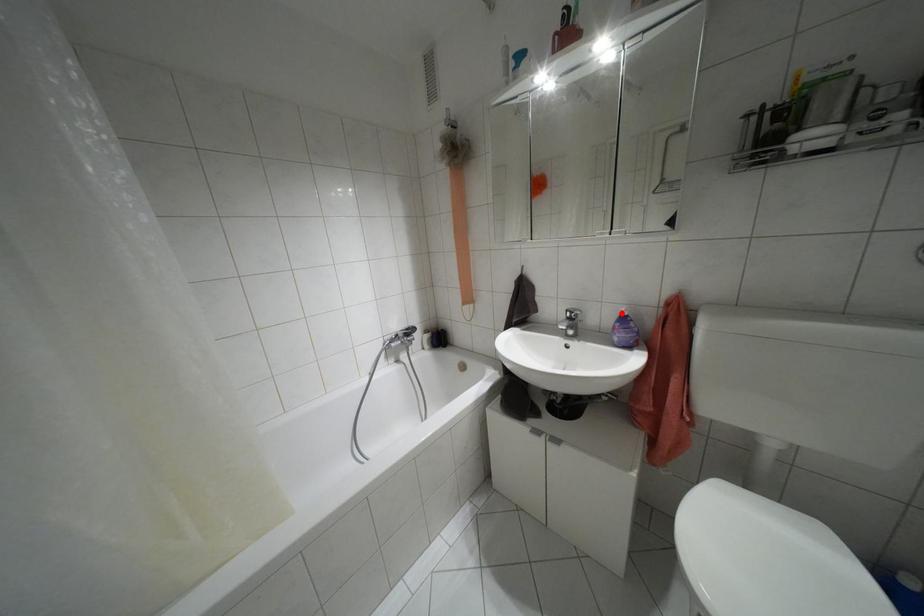
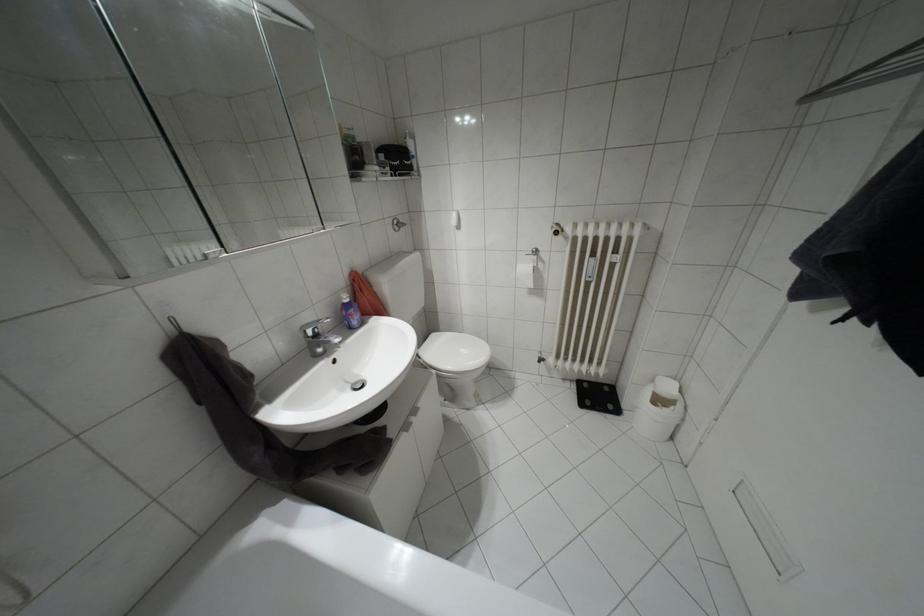
The point at the highlighted location is marked in the first image. Where is the corresponding point in the second image?

(346, 300)